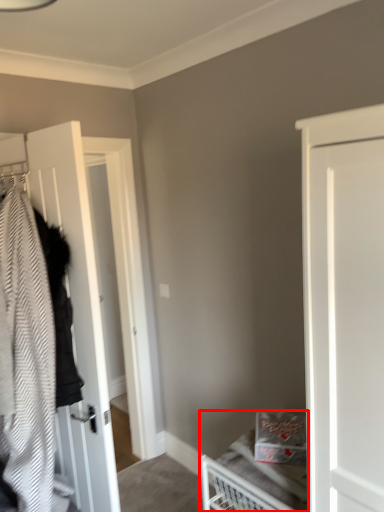
Question: Where is bed (annotated by the red box) located in relation to door in the image?

Choices:
 (A) left
 (B) right

Answer: (B)